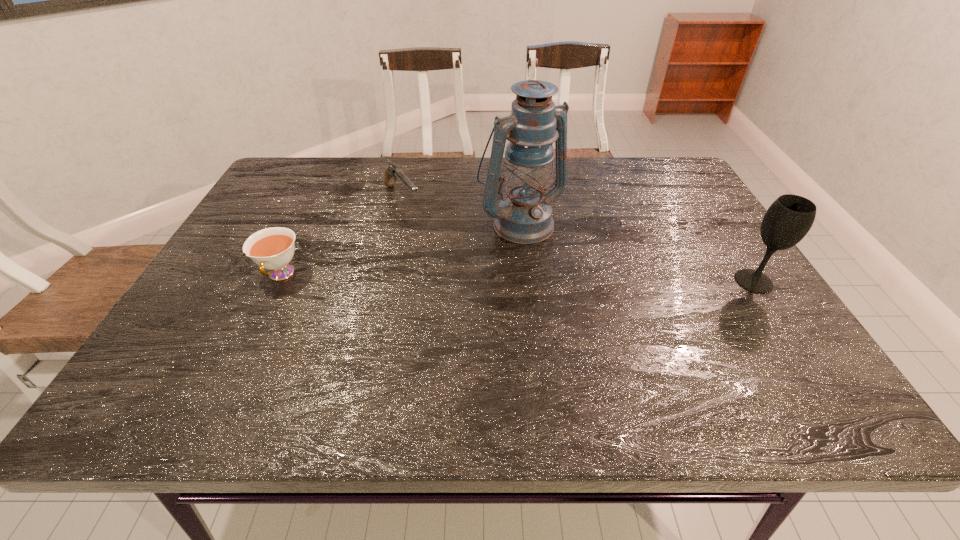
Image resolution: width=960 pixels, height=540 pixels. What are the coordinates of `vacant space at the far left corner of the desktop` in the screenshot? It's located at (300, 183).

This screenshot has width=960, height=540. Find the location of `vacant space at the far right corner of the desktop`. vacant space at the far right corner of the desktop is located at coordinates (678, 185).

You are a GUI agent. You are given a task and a screenshot of the screen. Output one action in this format:
    pyautogui.click(x=<x>, y=<y>)
    Task: Click on the vacant space that's between the lantern and the wineglass
    This screenshot has height=540, width=960.
    Given the screenshot: What is the action you would take?
    pyautogui.click(x=637, y=251)

Identify the location of vacant area that lies between the gun and the lantern. This screenshot has width=960, height=540. (461, 210).

This screenshot has width=960, height=540. I want to click on free space that is in between the third shortest object and the third object from right to left, so click(x=578, y=240).

Where is `empty space between the lantern and the teacup`? This screenshot has height=540, width=960. empty space between the lantern and the teacup is located at coordinates (400, 248).

At what (x,y) coordinates should I click in order to perform the action: click on vacant space that is in between the leftmost object and the third object from right to left. Please return your answer as a coordinate pair (x, y). Looking at the image, I should click on (342, 237).

Where is `empty location between the tallest object and the gun`? empty location between the tallest object and the gun is located at coordinates (461, 210).

Image resolution: width=960 pixels, height=540 pixels. What are the coordinates of `vacant space that is in between the second tallest object and the second object from left to right` in the screenshot? It's located at (578, 240).

Where is `object that can be found as the second closest to the tallest object`? This screenshot has width=960, height=540. object that can be found as the second closest to the tallest object is located at coordinates (790, 217).